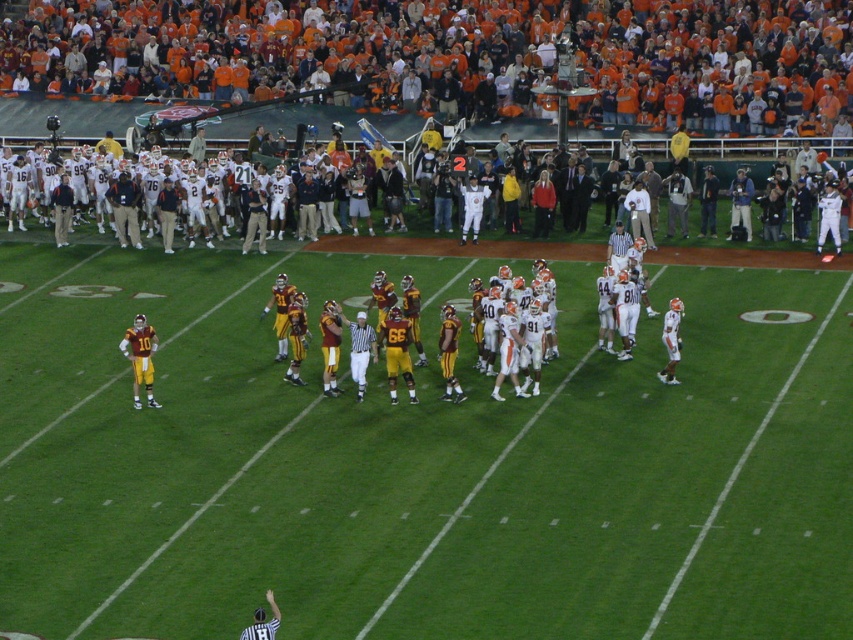
Is orange jersey fans at upper center behind yellow uniformed players at center?

Yes.

Where is `orange jersey fans at upper center`? The image size is (853, 640). orange jersey fans at upper center is located at coordinates (434, 52).

This screenshot has height=640, width=853. What are the coordinates of `orange jersey fans at upper center` in the screenshot? It's located at (434, 52).